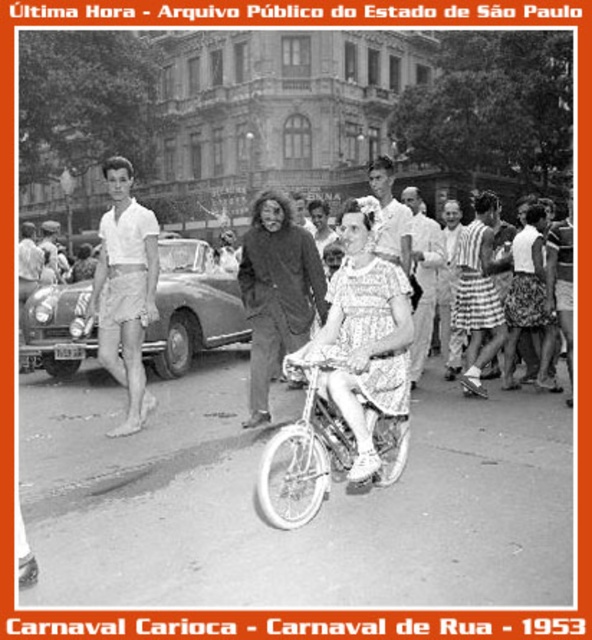
You are a photographer standing at the point with coordinates point (x=406, y=189). You want to take a photo of the woman on the bicycle at point (x=246, y=289). Will the man standing beside her block your view?

Point (x=246, y=289) is in front of point (x=406, y=189), so the man standing beside the woman on the bicycle at point (x=246, y=289) will not block your view because the woman and the man are closer to you than the photographer at point (x=406, y=189).

You are a photographer at the Carnaval Carioca in 1953 in Sao Paulo. You are standing at the point marked by the coordinate point [124,291]. What object is located at that point?

The point [124,291] marks white cotton shorts at left.